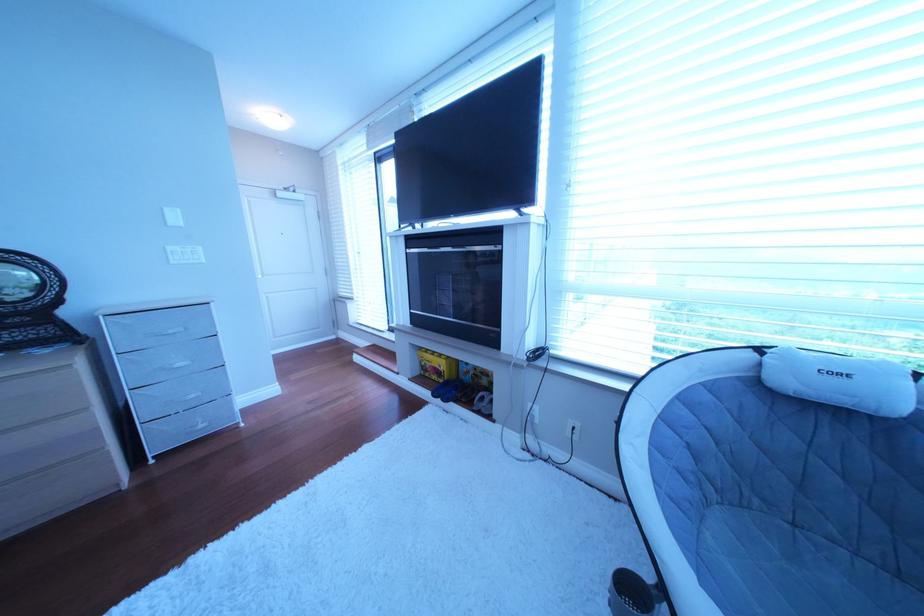
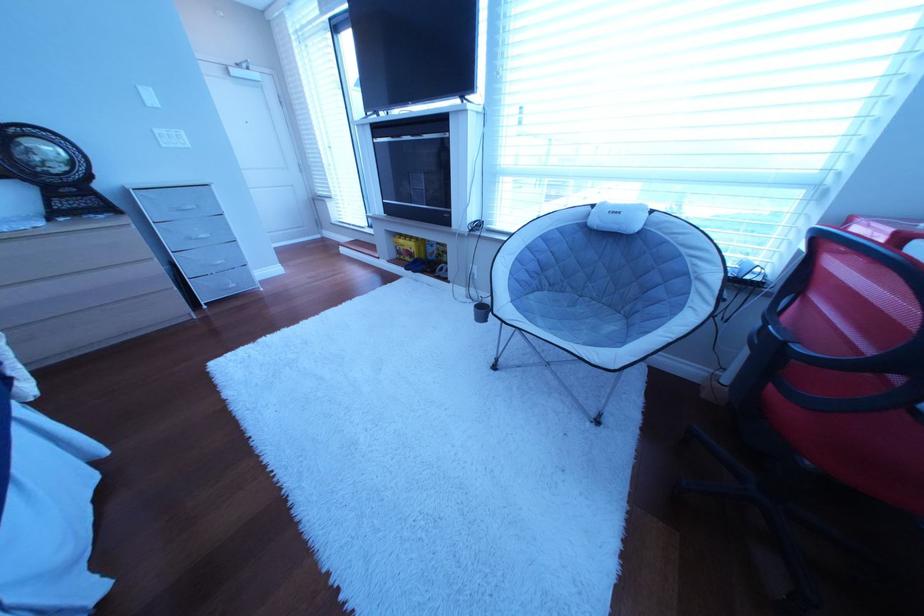
The point at (188, 264) is marked in the first image. Where is the corresponding point in the second image?

(179, 148)